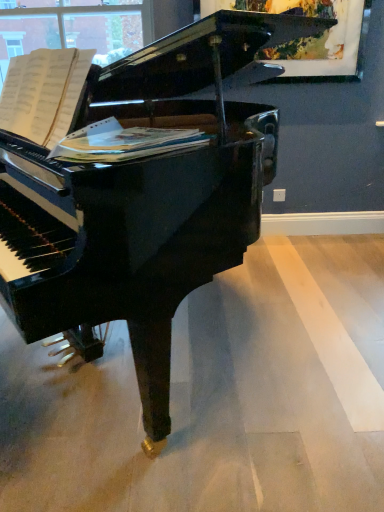
Question: Looking at the image, does white paper at center seem bigger or smaller compared to wooden picture frame at upper right?

Choices:
 (A) small
 (B) big

Answer: (A)

Question: Choose the correct answer: Is white paper at center inside wooden picture frame at upper right or outside it?

Choices:
 (A) inside
 (B) outside

Answer: (B)

Question: From a real-world perspective, is white paper at center positioned above or below wooden picture frame at upper right?

Choices:
 (A) above
 (B) below

Answer: (B)

Question: Is wooden picture frame at upper right bigger or smaller than white paper at center?

Choices:
 (A) big
 (B) small

Answer: (A)

Question: In terms of height, does wooden picture frame at upper right look taller or shorter compared to white paper at center?

Choices:
 (A) tall
 (B) short

Answer: (A)

Question: Considering their positions, is wooden picture frame at upper right located in front of or behind white paper at center?

Choices:
 (A) front
 (B) behind

Answer: (B)

Question: Which is correct: wooden picture frame at upper right is inside white paper at center, or outside of it?

Choices:
 (A) inside
 (B) outside

Answer: (B)